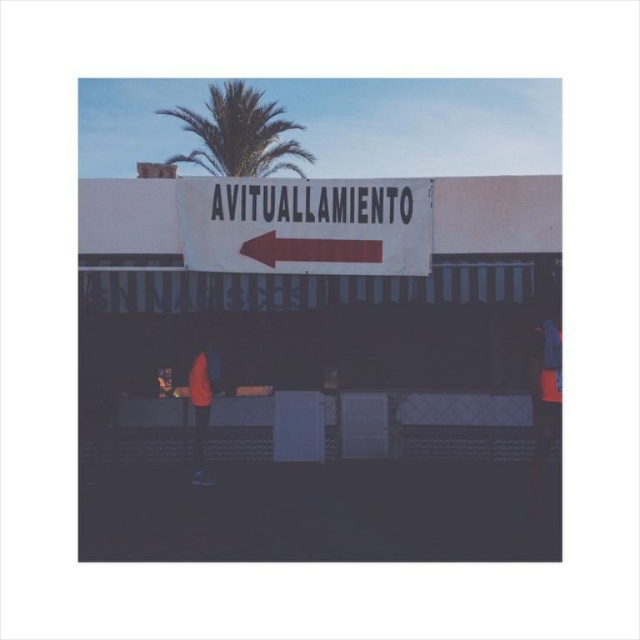
Question: Is green leafy palm tree at upper center wider than matte orange shirt at center?

Choices:
 (A) yes
 (B) no

Answer: (A)

Question: Which of these objects is positioned closest to the matte orange shirt at center?

Choices:
 (A) white matte sign at center
 (B) green leafy palm tree at upper center

Answer: (A)

Question: Which of the following is the farthest from the observer?

Choices:
 (A) green leafy palm tree at upper center
 (B) matte orange shirt at center
 (C) white matte sign at center

Answer: (A)

Question: Which point is closer to the camera?

Choices:
 (A) (248, 125)
 (B) (205, 243)

Answer: (B)

Question: Does green leafy palm tree at upper center appear over matte orange shirt at center?

Choices:
 (A) no
 (B) yes

Answer: (B)

Question: In this image, where is green leafy palm tree at upper center located relative to matte orange shirt at center?

Choices:
 (A) above
 (B) below

Answer: (A)